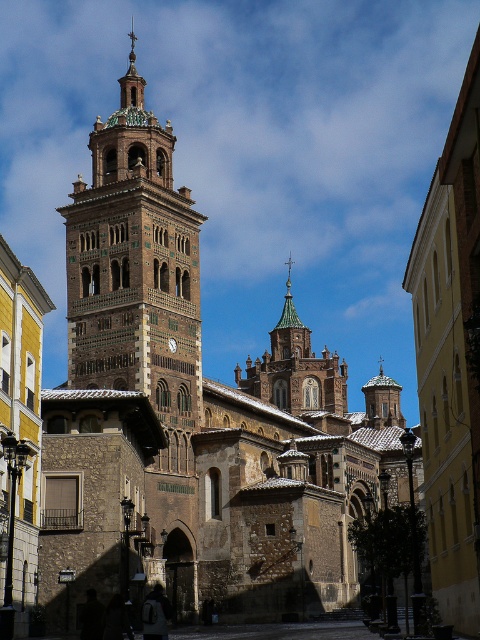
Question: Can you confirm if green copper spire at center is bigger than gold textured spire at upper center?

Choices:
 (A) yes
 (B) no

Answer: (B)

Question: Does green copper spire at center appear under gold textured spire at upper center?

Choices:
 (A) yes
 (B) no

Answer: (A)

Question: Which of the following is the closest to the observer?

Choices:
 (A) green copper spire at center
 (B) gold textured spire at upper center

Answer: (B)

Question: Which object appears farthest from the camera in this image?

Choices:
 (A) gold textured spire at upper center
 (B) green copper spire at center

Answer: (B)

Question: Among these points, which one is farthest from the camera?

Choices:
 (A) (290, 298)
 (B) (140, 99)

Answer: (A)

Question: From the image, what is the correct spatial relationship of green copper spire at center in relation to gold textured spire at upper center?

Choices:
 (A) left
 (B) right

Answer: (B)